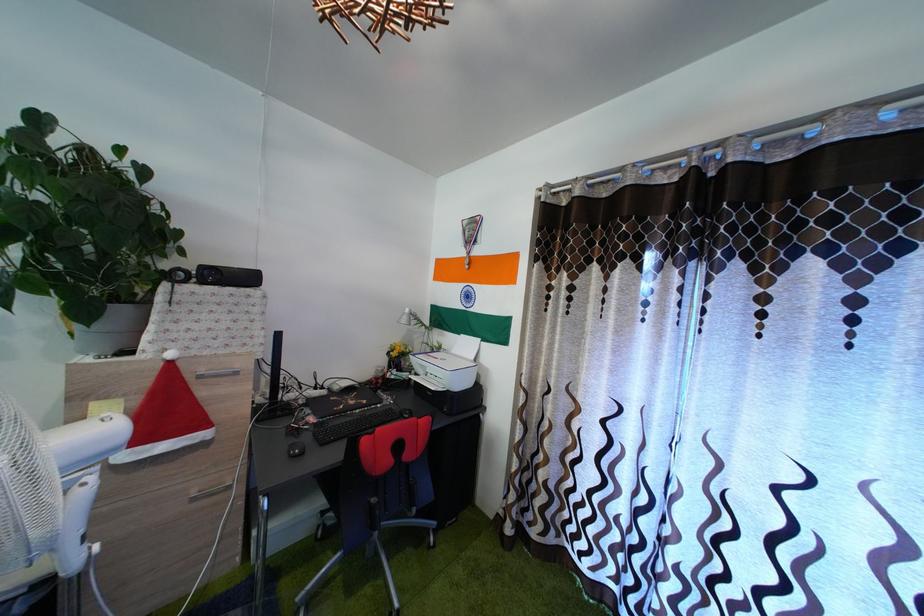
Where would you lift the white printer lid? Please return your answer as a coordinate pair (x, y).

(445, 359)